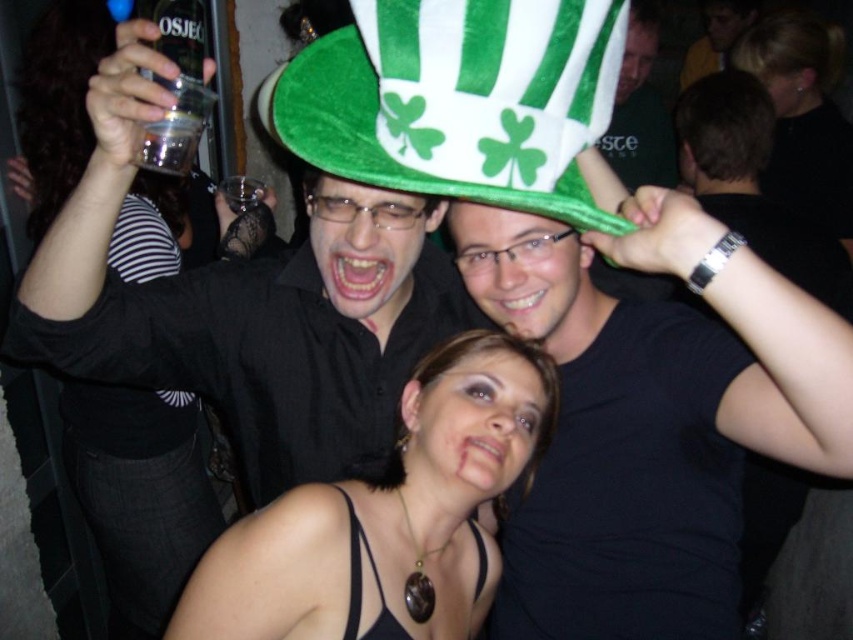
Question: In this image, where is black matte shirt at center located relative to clear plastic cup at upper left?

Choices:
 (A) above
 (B) below

Answer: (B)

Question: Does black matte shirt at center appear under black matte shirt at upper center?

Choices:
 (A) yes
 (B) no

Answer: (A)

Question: Which is nearer to the felt green hat at upper center?

Choices:
 (A) black matte shirt at center
 (B) matte black shirt at upper center
 (C) black satin dress at center
 (D) clear plastic cup at upper left

Answer: (C)

Question: Is felt green hat at upper center positioned at the back of black satin dress at center?

Choices:
 (A) yes
 (B) no

Answer: (B)

Question: Estimate the real-world distances between objects in this image. Which object is farther from the black matte shirt at upper center?

Choices:
 (A) matte black shirt at upper center
 (B) black satin dress at center
 (C) felt green hat at upper center

Answer: (B)

Question: Which of these objects is positioned farthest from the black satin dress at center?

Choices:
 (A) black matte shirt at upper center
 (B) matte black shirt at upper center

Answer: (B)